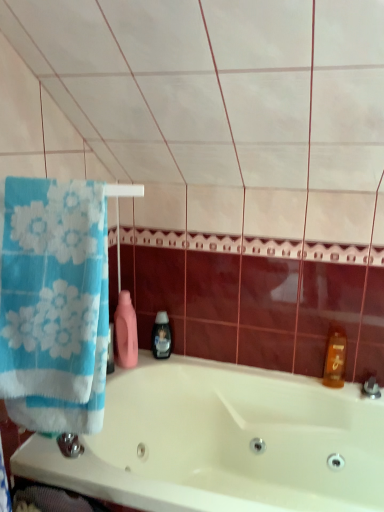
Question: Should I look upward or downward to see black plastic soap dispenser at center?

Choices:
 (A) up
 (B) down

Answer: (B)

Question: Considering the relative sizes of blue cotton towel at left and translucent amber bottle at right in the image provided, is blue cotton towel at left smaller than translucent amber bottle at right?

Choices:
 (A) no
 (B) yes

Answer: (A)

Question: Is blue cotton towel at left not inside translucent amber bottle at right?

Choices:
 (A) yes
 (B) no

Answer: (A)

Question: Is blue cotton towel at left taller than translucent amber bottle at right?

Choices:
 (A) no
 (B) yes

Answer: (B)

Question: From the image's perspective, is blue cotton towel at left on top of translucent amber bottle at right?

Choices:
 (A) no
 (B) yes

Answer: (B)

Question: Is translucent amber bottle at right a part of blue cotton towel at left?

Choices:
 (A) yes
 (B) no

Answer: (B)

Question: From the image's perspective, is blue cotton towel at left beneath translucent amber bottle at right?

Choices:
 (A) no
 (B) yes

Answer: (A)

Question: From a real-world perspective, is translucent amber bottle at right positioned over blue cotton towel at left based on gravity?

Choices:
 (A) no
 (B) yes

Answer: (A)

Question: Considering the relative positions of translucent amber bottle at right and blue cotton towel at left in the image provided, is translucent amber bottle at right to the right of blue cotton towel at left from the viewer's perspective?

Choices:
 (A) yes
 (B) no

Answer: (A)

Question: Is translucent amber bottle at right not inside blue cotton towel at left?

Choices:
 (A) no
 (B) yes

Answer: (B)

Question: Is translucent amber bottle at right facing towards blue cotton towel at left?

Choices:
 (A) yes
 (B) no

Answer: (B)

Question: Could blue cotton towel at left be considered to be inside translucent amber bottle at right?

Choices:
 (A) no
 (B) yes

Answer: (A)

Question: Is translucent amber bottle at right far from blue cotton towel at left?

Choices:
 (A) no
 (B) yes

Answer: (B)

Question: Considering the relative positions of black plastic soap dispenser at center and translucent amber bottle at right in the image provided, is black plastic soap dispenser at center in front of translucent amber bottle at right?

Choices:
 (A) no
 (B) yes

Answer: (A)